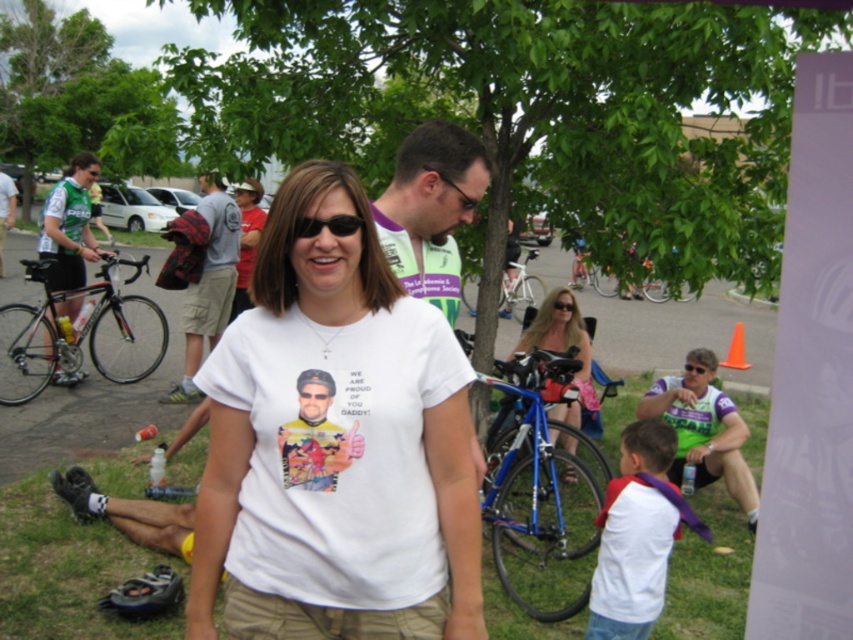
Question: Can you confirm if green jersey at lower right is positioned to the right of green jersey cyclist at left?

Choices:
 (A) no
 (B) yes

Answer: (B)

Question: Can you confirm if white cotton t-shirt at lower right is positioned to the right of green jersey cyclist at left?

Choices:
 (A) yes
 (B) no

Answer: (A)

Question: Can you confirm if white cotton t-shirt at center is bigger than green jersey at lower right?

Choices:
 (A) no
 (B) yes

Answer: (A)

Question: Which point is farther to the camera?

Choices:
 (A) matte black bicycle at left
 (B) white cotton t-shirt at center
 (C) black plastic sunglasses at center
 (D) gray cotton t-shirt at center

Answer: (A)

Question: Which point is farther from the camera taking this photo?

Choices:
 (A) (469, 280)
 (B) (553, 360)

Answer: (A)

Question: Which point is farther from the camera taking this photo?

Choices:
 (A) (71, 531)
 (B) (524, 272)
 (C) (680, 410)
 (D) (178, 397)

Answer: (B)